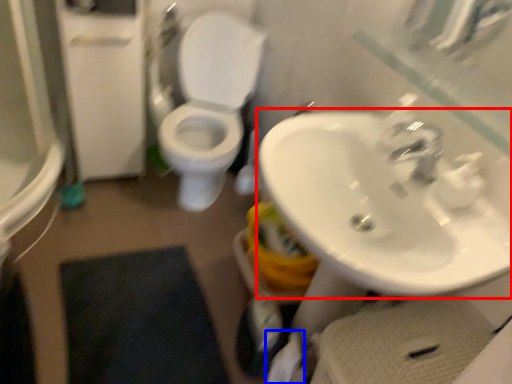
Question: Which object appears closest to the camera in this image, sink (highlighted by a red box) or toilet paper (highlighted by a blue box)?

Choices:
 (A) sink
 (B) toilet paper

Answer: (A)